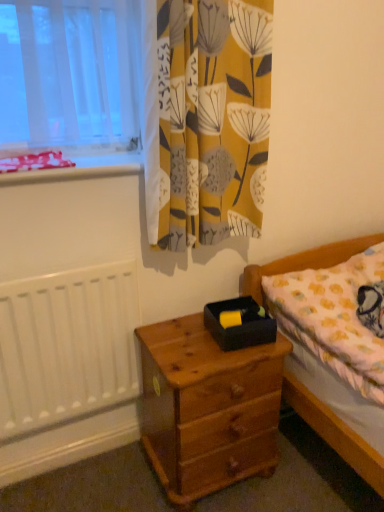
Image resolution: width=384 pixels, height=512 pixels. Identify the location of vacant space situated above wooden nightstand at lower center (from a real-world perspective). (198, 345).